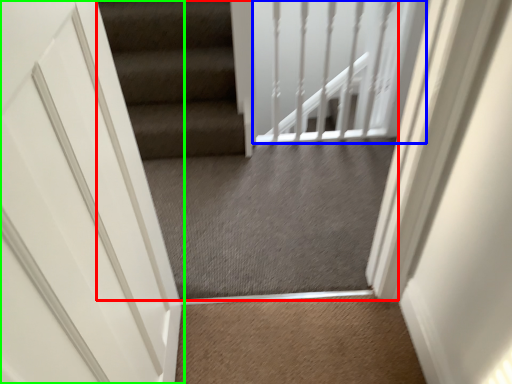
Question: Considering the real-world distances, which object is farthest from escalator (highlighted by a red box)? balustrade (highlighted by a blue box) or door (highlighted by a green box)?

Choices:
 (A) balustrade
 (B) door

Answer: (B)